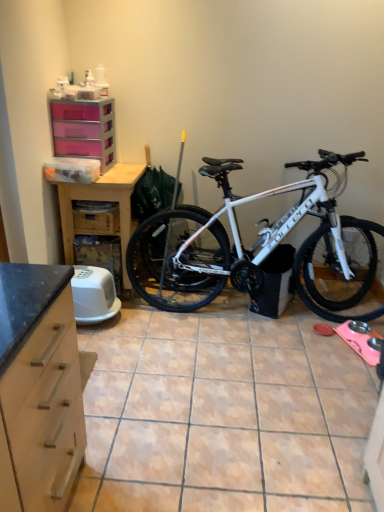
Where is `vacant space in front of white matte bicycle at center`? vacant space in front of white matte bicycle at center is located at coordinates (248, 385).